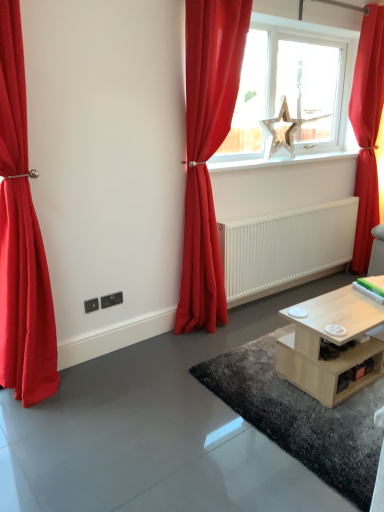
Question: Based on their sizes in the image, would you say matte red curtain at center, which is the 2th curtain in right-to-left order, is bigger or smaller than matte red curtain at left, the first curtain positioned from the left?

Choices:
 (A) small
 (B) big

Answer: (B)

Question: From the image's perspective, is matte red curtain at center, the 2th curtain in the left-to-right sequence, above or below matte red curtain at left, the first curtain positioned from the left?

Choices:
 (A) above
 (B) below

Answer: (A)

Question: Which is farther from the white smooth radiator at center?

Choices:
 (A) shiny wooden coffee table at lower center
 (B) white glossy radiator at center
 (C) matte red curtain at center, which is the 2th curtain in right-to-left order
 (D) red velvet curtain at right, placed as the 1th curtain when sorted from right to left
 (E) wooden star at center

Answer: (A)

Question: Based on their relative distances, which object is farther from the white glossy radiator at center?

Choices:
 (A) red velvet curtain at right, arranged as the 3th curtain when viewed from the left
 (B) light wood/woodenobject at lower right
 (C) matte red curtain at center, the 2th curtain in the left-to-right sequence
 (D) matte red curtain at left, the first curtain positioned from the left
 (E) white smooth radiator at center

Answer: (D)